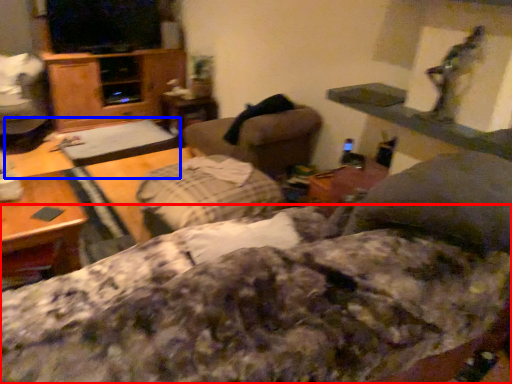
Question: Which object is further to the camera taking this photo, bedding (highlighted by a red box) or table (highlighted by a blue box)?

Choices:
 (A) bedding
 (B) table

Answer: (B)